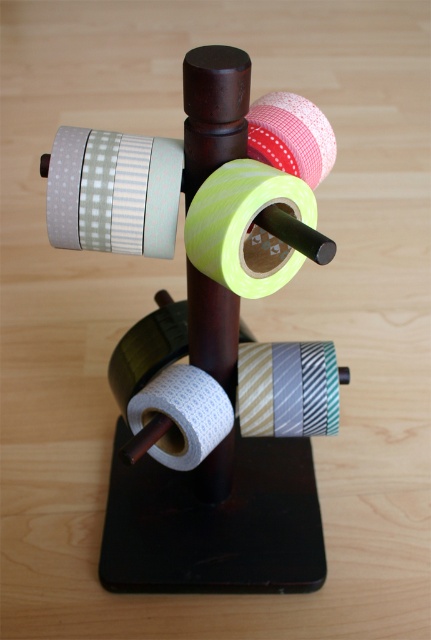
Question: Is neon yellow matte tape at center smaller than red gingham tape at center?

Choices:
 (A) yes
 (B) no

Answer: (B)

Question: Can you confirm if matte green and white checkered tape at upper left is positioned to the right of neon yellow matte tape at center?

Choices:
 (A) no
 (B) yes

Answer: (A)

Question: Estimate the real-world distances between objects in this image. Which object is closer to the neon yellow matte tape at center?

Choices:
 (A) white textured toilet paper at center
 (B) red gingham tape at center

Answer: (B)

Question: Among these objects, which one is farthest from the camera?

Choices:
 (A) white textured toilet paper at center
 (B) red gingham tape at center
 (C) neon yellow matte tape at center
 (D) matte green and white checkered tape at upper left

Answer: (A)

Question: Is neon yellow matte tape at center thinner than white textured toilet paper at center?

Choices:
 (A) no
 (B) yes

Answer: (B)

Question: Which point is farther to the camera?

Choices:
 (A) (215, 435)
 (B) (303, 243)
 (C) (314, 108)
 (D) (74, 243)

Answer: (A)